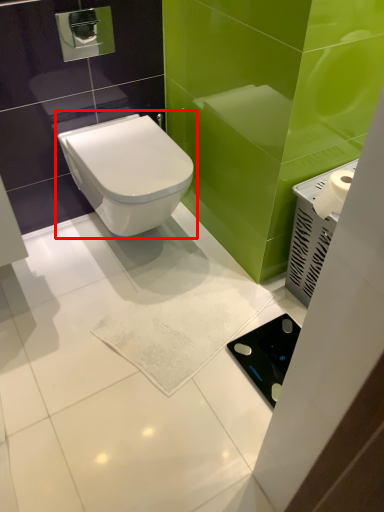
Question: From the image's perspective, what is the correct spatial positioning of toilet (annotated by the red box) in reference to appliance?

Choices:
 (A) below
 (B) above

Answer: (B)